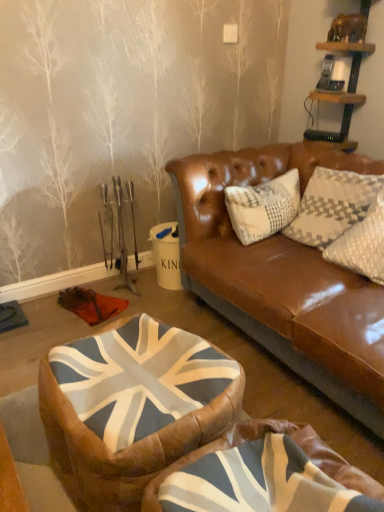
Question: From a real-world perspective, is union jack fabric bean bag at center, arranged as the 2th bean bag chair when viewed from the front, positioned above or below union jack fabric bean bag at center, positioned as the 2th bean bag chair in back-to-front order?

Choices:
 (A) below
 (B) above

Answer: (A)

Question: Does point pos(57,415) appear closer or farther from the camera than point pos(196,455)?

Choices:
 (A) closer
 (B) farther

Answer: (B)

Question: Estimate the real-world distances between objects in this image. Which object is farther from the union jack fabric bean bag at center, arranged as the 2th bean bag chair when viewed from the front?

Choices:
 (A) wooden shelf at upper right
 (B) union jack fabric bean bag at center, the first bean bag chair from the front

Answer: (A)

Question: Based on their relative distances, which object is farther from the wooden shelf at upper right?

Choices:
 (A) union jack fabric bean bag at center, arranged as the 2th bean bag chair when viewed from the front
 (B) union jack fabric bean bag at center, the first bean bag chair from the front

Answer: (B)